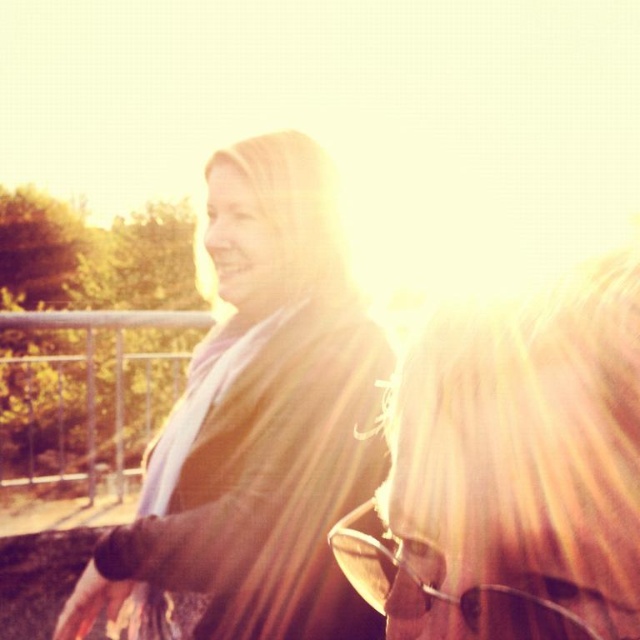
Is point (148, 499) closer to camera compared to point (417, 589)?

No, it is not.

Locate an element on the screen. Image resolution: width=640 pixels, height=640 pixels. matte black jacket at center is located at coordinates (259, 424).

The height and width of the screenshot is (640, 640). Identify the location of matte black jacket at center. (259, 424).

The height and width of the screenshot is (640, 640). In order to click on matte black jacket at center in this screenshot , I will do `click(259, 424)`.

Consider the image. Measure the distance between matte black jacket at center and blonde hair at upper right.

matte black jacket at center and blonde hair at upper right are 20.94 inches apart.

Is point (269, 196) less distant than point (634, 451)?

No, it is not.

Where is `matte black jacket at center`? The height and width of the screenshot is (640, 640). matte black jacket at center is located at coordinates (259, 424).

Can you confirm if blonde hair at upper right is wider than sunglasses at center?

Yes.

Who is more distant from viewer, [518,624] or [536,604]?

The point [518,624] is more distant.

At what (x,y) coordinates should I click in order to perform the action: click on blonde hair at upper right. Please return your answer as a coordinate pair (x, y). The image size is (640, 640). Looking at the image, I should click on (x=512, y=470).